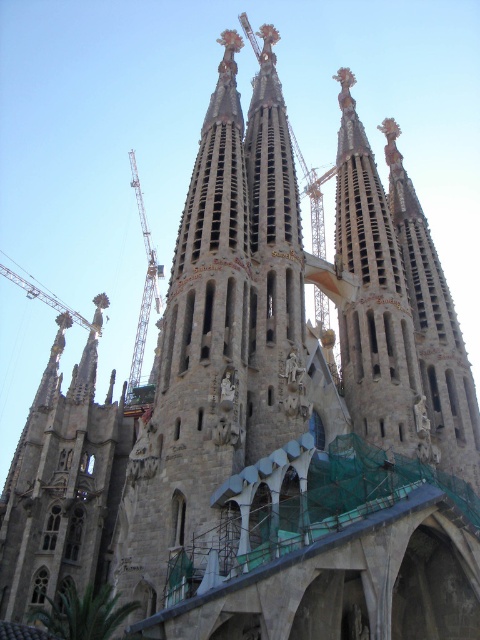
You are a construction worker who needs to choose between two cranes to lift a heavy beam. The beam is 10 meters wide. You see a metallic construction crane at center and a metallic construction crane at upper left. Which crane has a wider span to safely lift the beam?

The metallic construction crane at upper left has a wider span than the metallic construction crane at center, so it can safely lift the 10 meter wide beam.